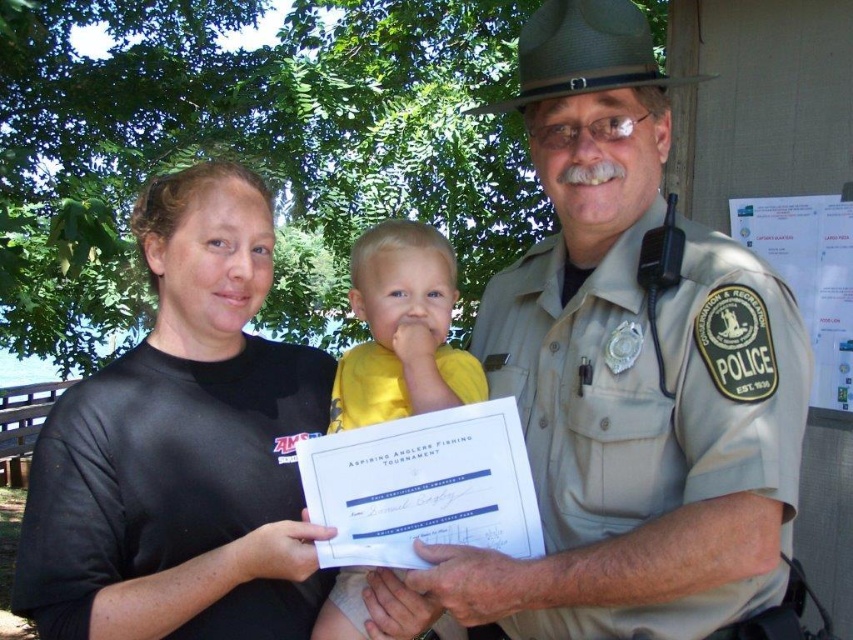
You are a photographer standing at the edge of the park. You need to capture a photo of both the khaki uniform at center and the yellow cotton shirt at center in the same frame without moving the subjects. Given that your camera has a minimum focus distance of 10 inches, can you take the photo?

The distance between the khaki uniform at center and the yellow cotton shirt at center is 12.58 inches, which is greater than the camera minimum focus distance of 10 inches. Therefore, the photographer can capture both subjects in the same frame without moving them.

You are a park ranger trying to locate the khaki uniform at center. According to the scene description, where would you find it?

The khaki uniform at center is located at point (x=630, y=372).